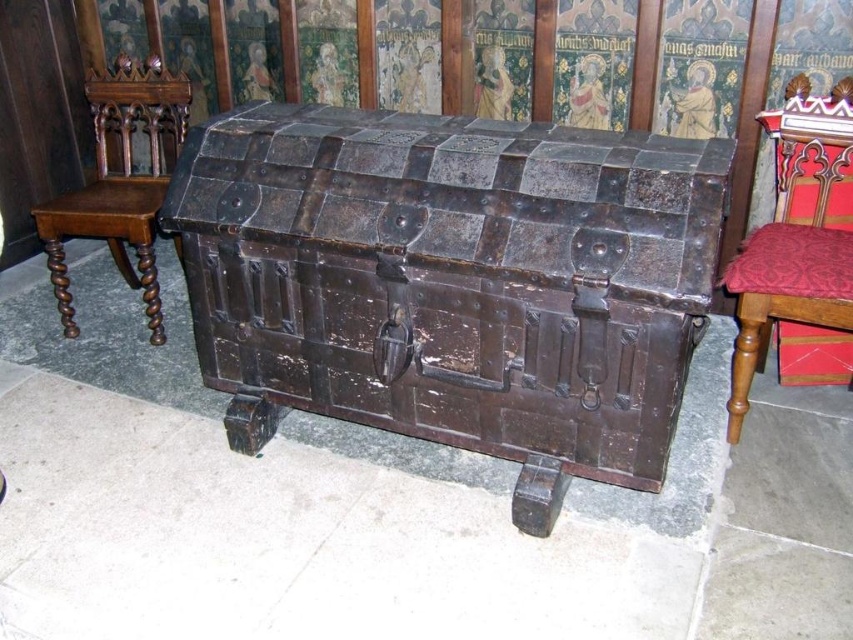
Which is in front, point (830, 298) or point (97, 204)?

Point (830, 298) is in front.

Between velvet red cushion at right and polished wood chair at left, which one has more height?

Standing taller between the two is polished wood chair at left.

Which is behind, point (764, 320) or point (103, 196)?

Point (103, 196)

The width and height of the screenshot is (853, 640). In order to click on velvet red cushion at right in this screenshot , I will do `click(798, 236)`.

Who is positioned more to the right, rusty metal chest at center or velvet red cushion at right?

From the viewer's perspective, velvet red cushion at right appears more on the right side.

Between point (419, 356) and point (747, 282), which one is positioned behind?

Positioned behind is point (747, 282).

Image resolution: width=853 pixels, height=640 pixels. I want to click on rusty metal chest at center, so click(x=453, y=282).

Locate an element on the screen. The width and height of the screenshot is (853, 640). rusty metal chest at center is located at coordinates (453, 282).

Is rusty metal chest at center smaller than polished wood chair at left?

No, rusty metal chest at center is not smaller than polished wood chair at left.

Can you confirm if rusty metal chest at center is taller than polished wood chair at left?

Indeed, rusty metal chest at center has a greater height compared to polished wood chair at left.

Is point (440, 346) positioned after point (154, 90)?

No.

This screenshot has height=640, width=853. I want to click on rusty metal chest at center, so click(x=453, y=282).